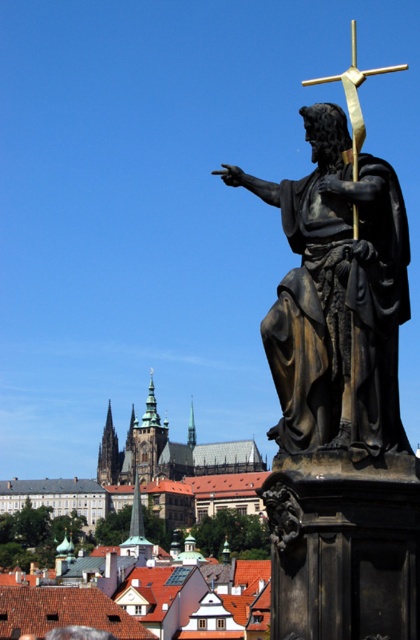
Question: Which object is positioned closest to the shiny gold statue at right?

Choices:
 (A) gold polished crucifix at upper center
 (B) bronze statue at right

Answer: (B)

Question: Which of the following is the closest to the observer?

Choices:
 (A) shiny gold statue at right
 (B) gold polished crucifix at upper center

Answer: (B)

Question: Which of the following is the closest to the observer?

Choices:
 (A) bronze statue at right
 (B) shiny gold statue at right
 (C) gold polished crucifix at upper center

Answer: (A)

Question: Is gold polished crucifix at upper center smaller than shiny gold statue at right?

Choices:
 (A) no
 (B) yes

Answer: (A)

Question: Is bronze statue at right behind gold polished crucifix at upper center?

Choices:
 (A) yes
 (B) no

Answer: (B)

Question: Can you confirm if bronze statue at right is bigger than gold polished crucifix at upper center?

Choices:
 (A) no
 (B) yes

Answer: (A)